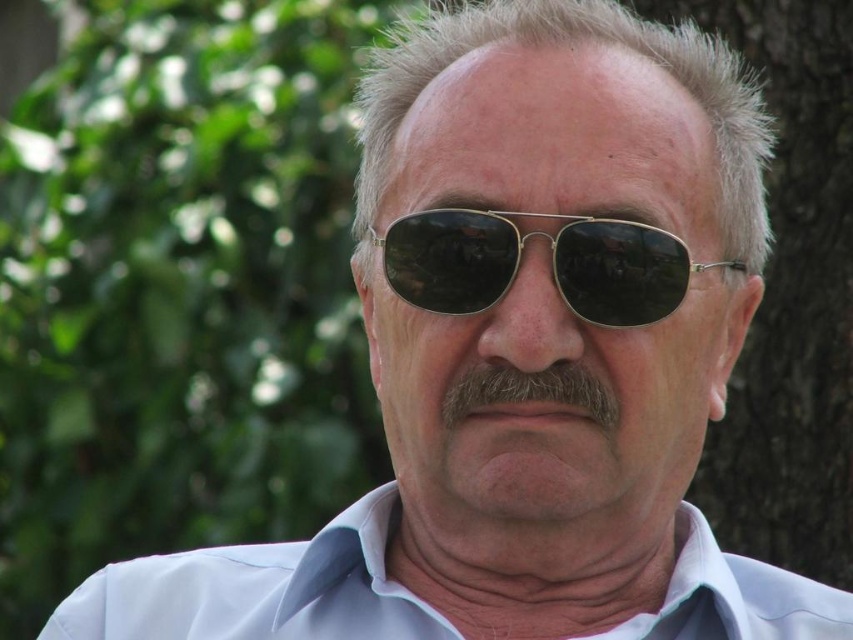
You are standing in a park and see two points marked in the image. The first point is at coordinate point(418, 285) and the second point is at point(561, 440). Which point is closer to you?

Point(561, 440) is closer to you because it is in front of point(418, 285).

You are a photographer adjusting your camera focus. You have two points in the image to focus on, point 1 at coordinates point (511, 467) and point 2 at coordinates point (561, 385). If you want to focus on the closer point to the viewer, which coordinate should you choose?

Point (511, 467) is further to the viewer than point (561, 385), so to focus on the closer point to the viewer, you should choose point (561, 385).